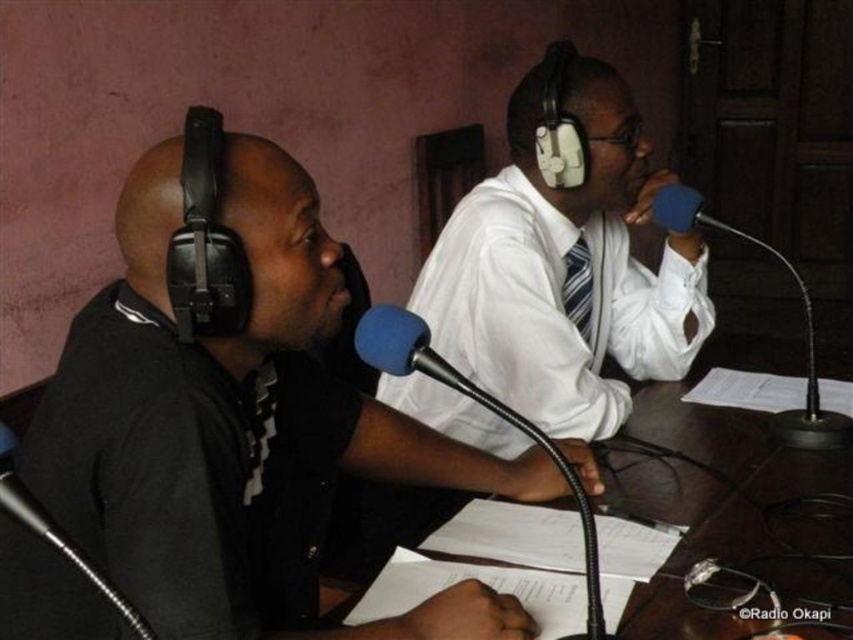
Between white glossy shirt at center and blue foam microphone at center, which one is positioned higher?

blue foam microphone at center

Is point (514, 93) behind point (682, 220)?

That is True.

Who is more distant from viewer, (x=582, y=83) or (x=688, y=216)?

The point (x=582, y=83) is behind.

Locate an element on the screen. The width and height of the screenshot is (853, 640). white glossy shirt at center is located at coordinates (563, 260).

Between point (570, 284) and point (697, 209), which one is positioned in front?

Point (697, 209)

Image resolution: width=853 pixels, height=640 pixels. Describe the element at coordinates (578, 285) in the screenshot. I see `striped fabric tie at center` at that location.

In the scene shown: Measure the distance between point (573, 246) and camera.

A distance of 5.66 feet exists between point (573, 246) and camera.

Locate an element on the screen. This screenshot has height=640, width=853. striped fabric tie at center is located at coordinates (578, 285).

Between point (699, 577) and point (827, 413), which one is positioned behind?

The point (827, 413) is behind.

Who is more distant from viewer, (807, 504) or (692, 208)?

Positioned behind is point (692, 208).

This screenshot has width=853, height=640. Find the location of `white paper at center`. white paper at center is located at coordinates (756, 502).